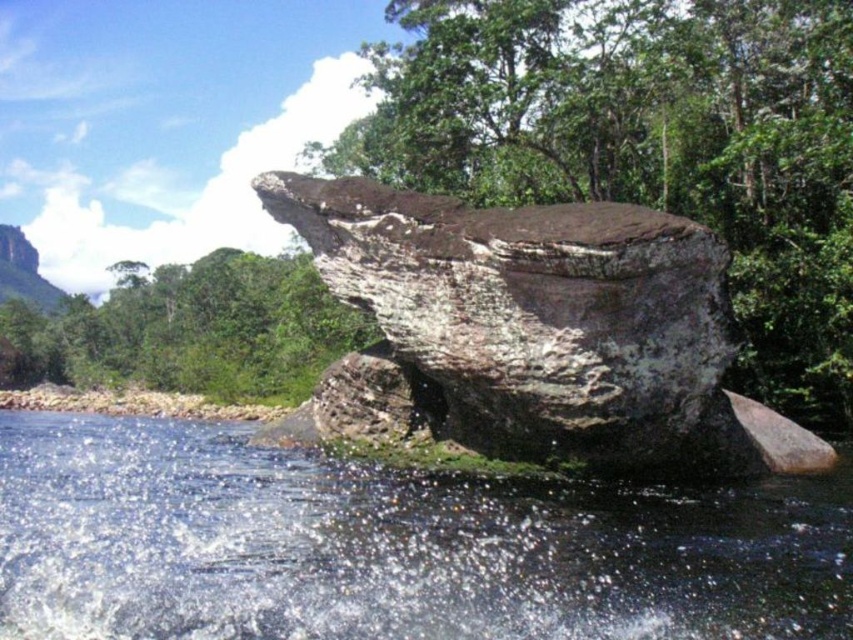
Question: Does clear water at center come in front of brown rough rock at center?

Choices:
 (A) yes
 (B) no

Answer: (A)

Question: Can you confirm if clear water at center is smaller than brown rough rock at center?

Choices:
 (A) yes
 (B) no

Answer: (A)

Question: Which object is farther from the camera taking this photo?

Choices:
 (A) clear water at center
 (B) brown rough rock at center

Answer: (B)

Question: Among these points, which one is farthest from the camera?

Choices:
 (A) [x=726, y=570]
 (B) [x=570, y=470]

Answer: (B)

Question: Which of the following is the closest to the observer?

Choices:
 (A) clear water at center
 (B) brown rough rock at center

Answer: (A)

Question: Can you confirm if clear water at center is positioned to the left of brown rough rock at center?

Choices:
 (A) yes
 (B) no

Answer: (A)